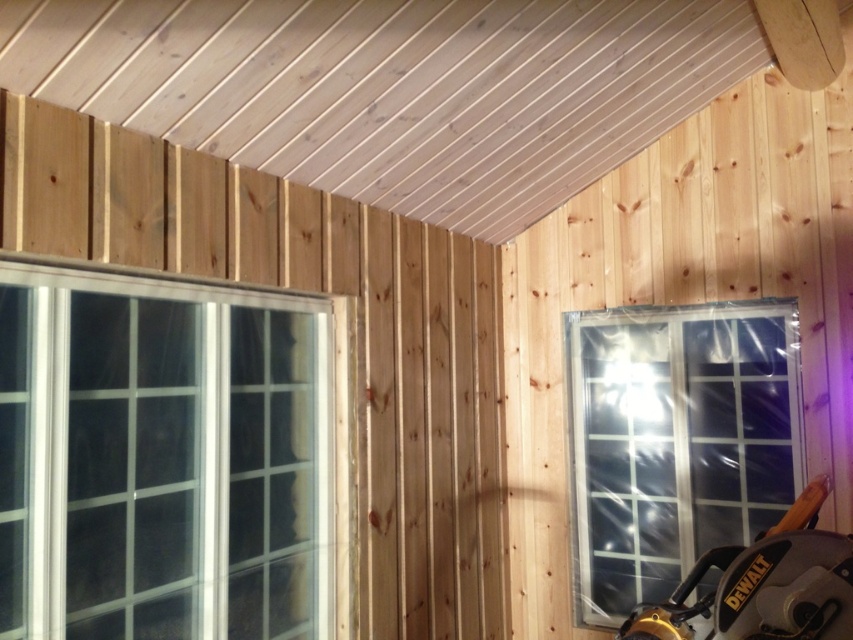
Question: From the image, what is the correct spatial relationship of clear plastic window at center right in relation to black plastic saw at lower right?

Choices:
 (A) right
 (B) left

Answer: (B)

Question: Where is clear glass window at left located in relation to black plastic saw at lower right in the image?

Choices:
 (A) below
 (B) above

Answer: (B)

Question: Estimate the real-world distances between objects in this image. Which object is farther from the clear plastic window at center right?

Choices:
 (A) black plastic saw at lower right
 (B) clear glass window at left

Answer: (B)

Question: Which point is farther to the camera?

Choices:
 (A) black plastic saw at lower right
 (B) clear glass window at left
 (C) clear plastic window at center right

Answer: (C)

Question: Does clear glass window at left have a smaller size compared to clear plastic window at center right?

Choices:
 (A) no
 (B) yes

Answer: (A)

Question: Which of the following is the farthest from the observer?

Choices:
 (A) clear glass window at left
 (B) black plastic saw at lower right

Answer: (B)